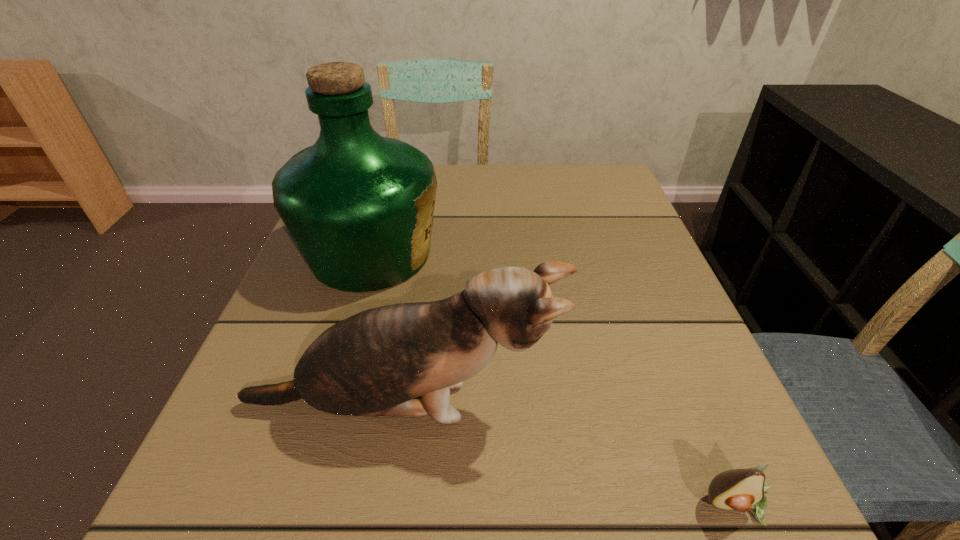
Where is `cat that is at the left edge`? Image resolution: width=960 pixels, height=540 pixels. cat that is at the left edge is located at coordinates (377, 362).

The image size is (960, 540). Find the location of `object at the right edge`. object at the right edge is located at coordinates (743, 490).

The width and height of the screenshot is (960, 540). Find the location of `object situated at the near right corner`. object situated at the near right corner is located at coordinates (743, 490).

Find the location of `vacant space at the far edge of the desktop`. vacant space at the far edge of the desktop is located at coordinates (525, 181).

Identify the location of vacant space at the near edge. This screenshot has width=960, height=540. tap(627, 504).

What are the coordinates of `vacant area at the left edge` in the screenshot? It's located at (321, 299).

The width and height of the screenshot is (960, 540). In the image, there is a desktop. In order to click on vacant space at the right edge in this screenshot , I will do `click(697, 336)`.

I want to click on free space at the far right corner, so click(x=606, y=194).

I want to click on free spot between the avocado and the cat, so click(x=569, y=455).

This screenshot has height=540, width=960. Find the location of `free space between the second shortest object and the avocado`. free space between the second shortest object and the avocado is located at coordinates (569, 455).